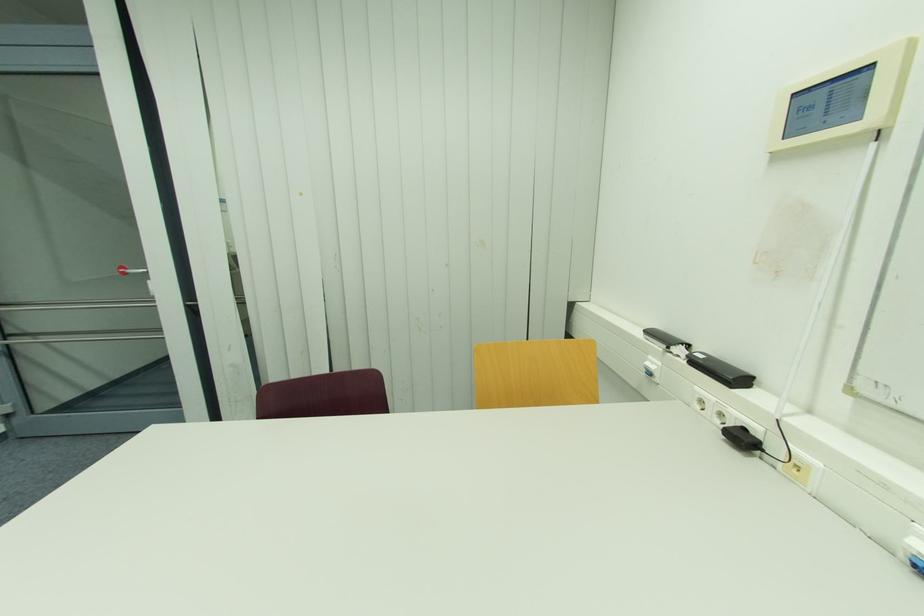
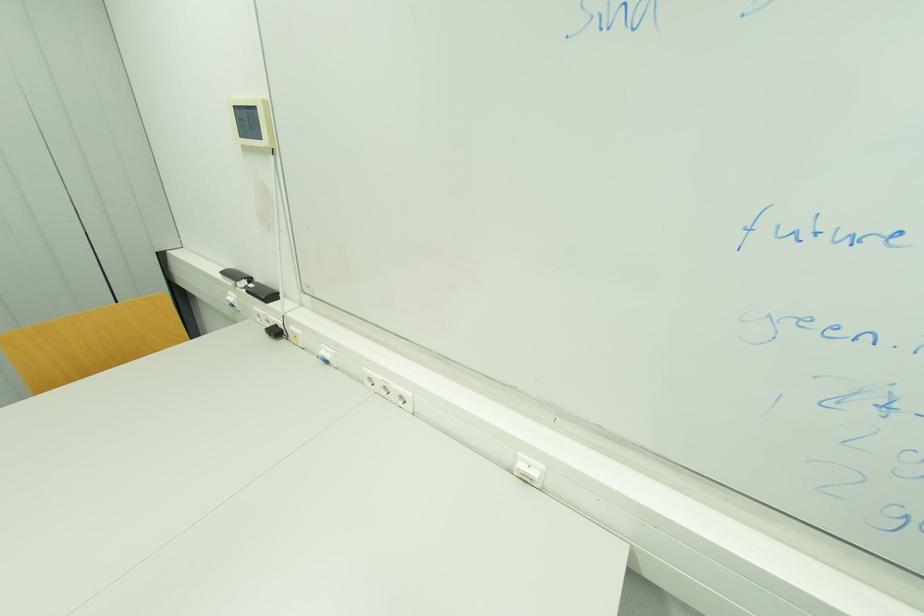
Locate, in the second image, the point that corresponds to (799,94) in the first image.

(237, 108)